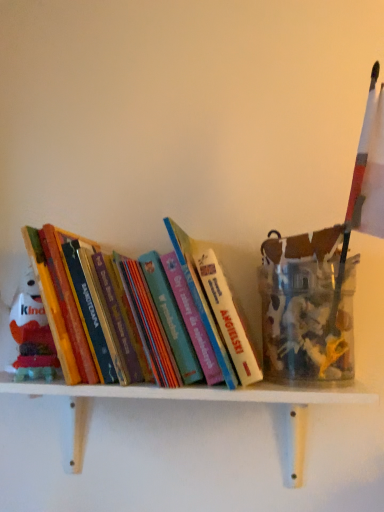
Where is `hardcover books at center`? hardcover books at center is located at coordinates (142, 313).

What is the approximate height of hardcover books at center?

The height of hardcover books at center is 10.06 inches.

What do you see at coordinates (142, 313) in the screenshot? This screenshot has height=512, width=384. I see `hardcover books at center` at bounding box center [142, 313].

Where is `white wooden shelf at center`? This screenshot has width=384, height=512. white wooden shelf at center is located at coordinates (199, 400).

The height and width of the screenshot is (512, 384). Describe the element at coordinates (199, 400) in the screenshot. I see `white wooden shelf at center` at that location.

This screenshot has width=384, height=512. Identify the location of hardcover books at center. (142, 313).

Would you say white wooden shelf at center is to the left or to the right of hardcover books at center in the picture?

From the image, it's evident that white wooden shelf at center is to the right of hardcover books at center.

Considering the positions of objects white wooden shelf at center and hardcover books at center in the image provided, who is behind, white wooden shelf at center or hardcover books at center?

Positioned behind is hardcover books at center.

Which is nearer, (74, 447) or (171, 283)?

Point (74, 447) is positioned farther from the camera compared to point (171, 283).

From the image's perspective, is white wooden shelf at center located beneath hardcover books at center?

Yes, from the image's perspective, white wooden shelf at center is below hardcover books at center.

From a real-world perspective, between white wooden shelf at center and hardcover books at center, who is vertically lower?

In real-world perspective, white wooden shelf at center is lower.

Considering the relative sizes of white wooden shelf at center and hardcover books at center in the image provided, is white wooden shelf at center wider than hardcover books at center?

In fact, white wooden shelf at center might be narrower than hardcover books at center.

In terms of height, does white wooden shelf at center look taller or shorter compared to hardcover books at center?

white wooden shelf at center is shorter than hardcover books at center.

Is white wooden shelf at center bigger than hardcover books at center?

Yes.

Is white wooden shelf at center located outside hardcover books at center?

Yes, white wooden shelf at center is located beyond the bounds of hardcover books at center.

Is white wooden shelf at center not near hardcover books at center?

No.

Is white wooden shelf at center looking in the opposite direction of hardcover books at center?

No, hardcover books at center is not at the back of white wooden shelf at center.

What's the angular difference between white wooden shelf at center and hardcover books at center's facing directions?

white wooden shelf at center and hardcover books at center are facing 0.00183 degrees away from each other.

At what (x,y) coordinates should I click in order to perform the action: click on book that appears on the left of white wooden shelf at center. Please return your answer as a coordinate pair (x, y). The image size is (384, 512). Looking at the image, I should click on (142, 313).

Is hardcover books at center to the left of white wooden shelf at center from the viewer's perspective?

Yes.

Which object is further away from the camera taking this photo, hardcover books at center or white wooden shelf at center?

hardcover books at center is further from the camera.

Consider the image. Which point is more forward, [188,356] or [355,385]?

Positioned in front is point [188,356].

From the image's perspective, who appears lower, hardcover books at center or white wooden shelf at center?

From the image's view, white wooden shelf at center is below.

From a real-world perspective, between hardcover books at center and white wooden shelf at center, who is vertically lower?

white wooden shelf at center.

Between hardcover books at center and white wooden shelf at center, which one has smaller width?

With smaller width is white wooden shelf at center.

Can you confirm if hardcover books at center is taller than white wooden shelf at center?

Correct, hardcover books at center is much taller as white wooden shelf at center.

Between hardcover books at center and white wooden shelf at center, which one has smaller size?

hardcover books at center is smaller.

Can white wooden shelf at center be found inside hardcover books at center?

Definitely not — white wooden shelf at center is not inside hardcover books at center.

Is hardcover books at center not near white wooden shelf at center?

No, hardcover books at center is not far from white wooden shelf at center.

Is hardcover books at center aimed at white wooden shelf at center?

No.

How many degrees apart are the facing directions of hardcover books at center and white wooden shelf at center?

The angle between the facing direction of hardcover books at center and the facing direction of white wooden shelf at center is 0.00183 degrees.

Measure the distance from hardcover books at center to white wooden shelf at center.

hardcover books at center and white wooden shelf at center are 4.42 inches apart from each other.

Image resolution: width=384 pixels, height=512 pixels. Identify the location of shelf in front of the hardcover books at center. click(x=199, y=400).

At what (x,y) coordinates should I click in order to perform the action: click on shelf that is under the hardcover books at center (from a real-world perspective). Please return your answer as a coordinate pair (x, y). Image resolution: width=384 pixels, height=512 pixels. Looking at the image, I should click on (199, 400).

Where is `shelf located below the hardcover books at center (from the image's perspective)`? shelf located below the hardcover books at center (from the image's perspective) is located at coordinates point(199,400).